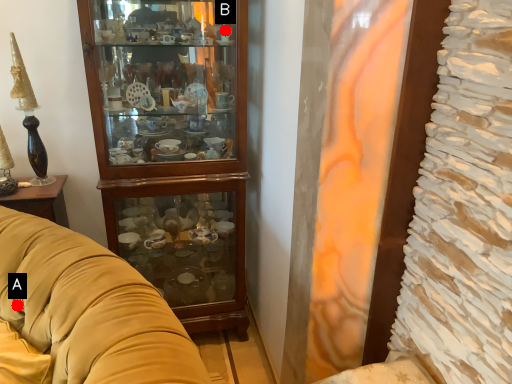
Question: Two points are circled on the image, labeled by A and B beside each circle. Which of the following is the farthest from the observer?

Choices:
 (A) A is further
 (B) B is further

Answer: (B)